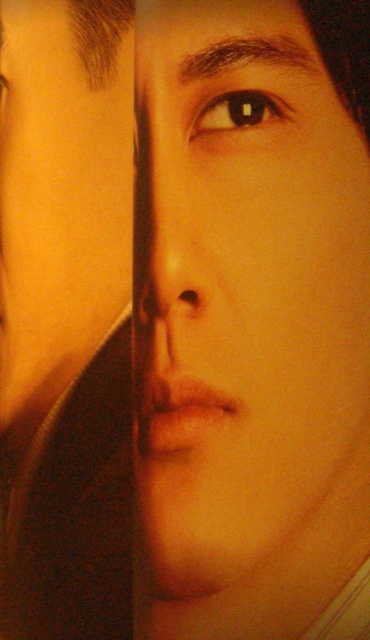
Question: Which of the following is the farthest from the observer?

Choices:
 (A) (236, 102)
 (B) (160, 515)

Answer: (B)

Question: From the image, what is the correct spatial relationship of smooth skin face at center in relation to brown glossy eye at upper center?

Choices:
 (A) right
 (B) left

Answer: (A)

Question: Which of the following is the closest to the observer?

Choices:
 (A) smooth skin face at center
 (B) brown glossy eye at upper center

Answer: (A)

Question: Does smooth skin face at center appear under brown glossy eye at upper center?

Choices:
 (A) no
 (B) yes

Answer: (B)

Question: Can you confirm if smooth skin face at center is smaller than brown glossy eye at upper center?

Choices:
 (A) no
 (B) yes

Answer: (A)

Question: Which point is farther to the camera?

Choices:
 (A) brown glossy eye at upper center
 (B) smooth skin face at center

Answer: (A)